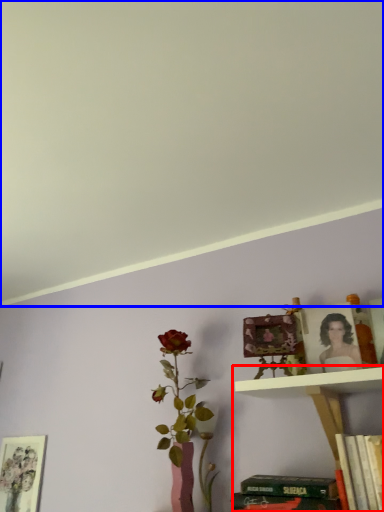
Question: Which point is further to the camera, shelf (highlighted by a red box) or backdrop (highlighted by a blue box)?

Choices:
 (A) shelf
 (B) backdrop

Answer: (A)